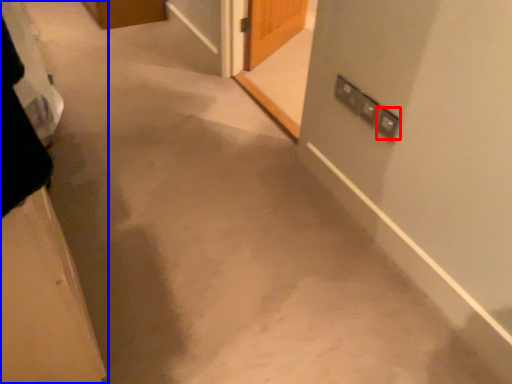
Question: Which point is closer to the camera, electric outlet (highlighted by a red box) or door (highlighted by a blue box)?

Choices:
 (A) electric outlet
 (B) door

Answer: (B)